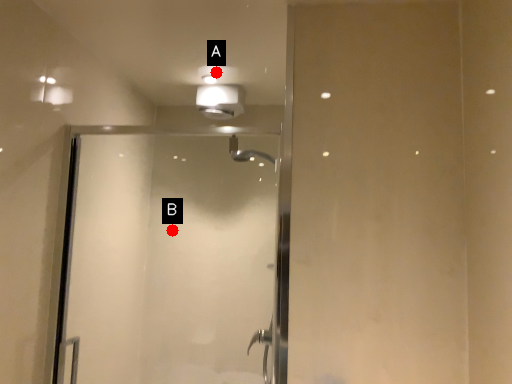
Question: Two points are circled on the image, labeled by A and B beside each circle. Among these points, which one is nearest to the camera?

Choices:
 (A) A is closer
 (B) B is closer

Answer: (A)